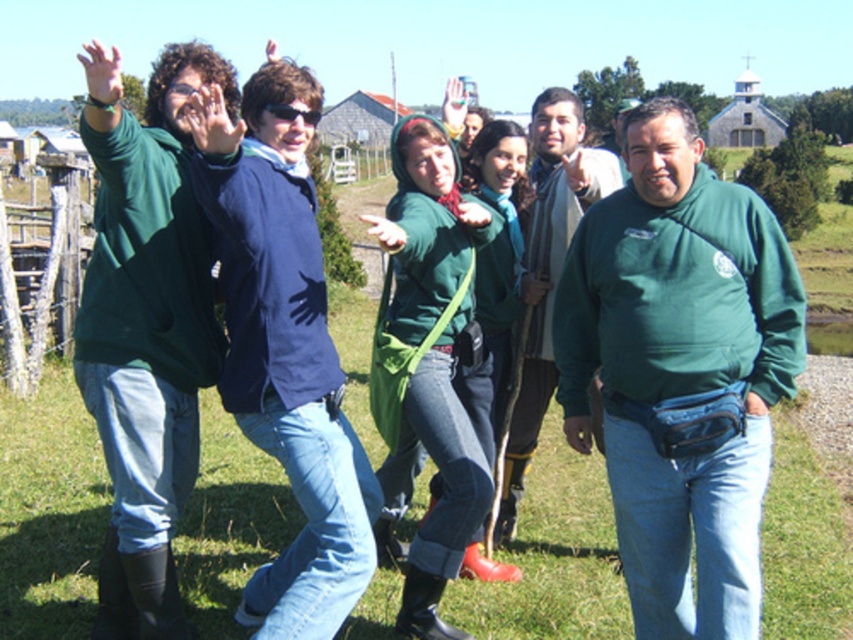
Question: Is the position of matte blue sweater at center more distant than that of matte green hoodie at center?

Choices:
 (A) yes
 (B) no

Answer: (B)

Question: Which point appears closest to the camera in this image?

Choices:
 (A) (x=341, y=504)
 (B) (x=569, y=241)
 (C) (x=71, y=428)

Answer: (A)

Question: Does green fleece jacket at center come behind matte green hoodie at center?

Choices:
 (A) no
 (B) yes

Answer: (A)

Question: Can you confirm if green grass at lower center is wider than matte blue sweater at center?

Choices:
 (A) no
 (B) yes

Answer: (A)

Question: Which is farther from the green fleece jacket at center?

Choices:
 (A) matte blue sweater at center
 (B) matte green hoodie at center

Answer: (A)

Question: Which point is farther to the camera?

Choices:
 (A) (265, 144)
 (B) (577, 477)
 (C) (538, 378)
 (D) (665, 486)

Answer: (B)